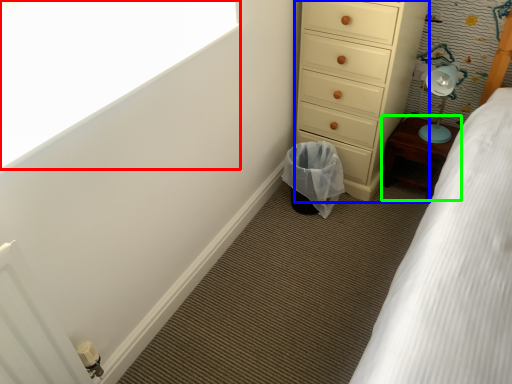
Question: Which object is the farthest from window screen (highlighted by a red box)? Choose among these: chest of drawers (highlighted by a blue box) or furniture (highlighted by a green box).

Choices:
 (A) chest of drawers
 (B) furniture

Answer: (B)